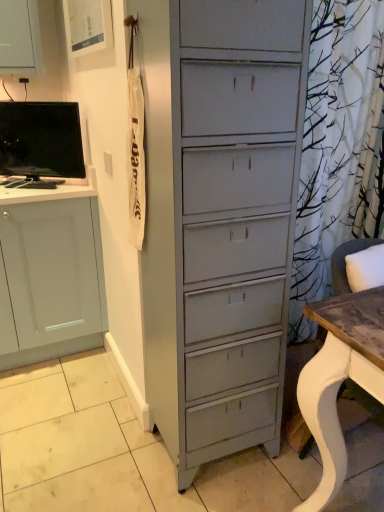
Question: Should I look upward or downward to see matte black monitor at left?

Choices:
 (A) up
 (B) down

Answer: (A)

Question: Considering the relative sizes of matte black monitor at left and white wood desk at right in the image provided, is matte black monitor at left smaller than white wood desk at right?

Choices:
 (A) yes
 (B) no

Answer: (A)

Question: From a real-world perspective, is matte black monitor at left on top of white wood desk at right?

Choices:
 (A) yes
 (B) no

Answer: (A)

Question: Would you consider matte black monitor at left to be distant from white wood desk at right?

Choices:
 (A) no
 (B) yes

Answer: (B)

Question: Is matte black monitor at left shorter than white wood desk at right?

Choices:
 (A) no
 (B) yes

Answer: (B)

Question: Considering the relative sizes of matte black monitor at left and white wood desk at right in the image provided, is matte black monitor at left wider than white wood desk at right?

Choices:
 (A) yes
 (B) no

Answer: (B)

Question: Does matte black monitor at left lie in front of white wood desk at right?

Choices:
 (A) yes
 (B) no

Answer: (B)

Question: Does white wood desk at right turn towards matte black monitor at left?

Choices:
 (A) no
 (B) yes

Answer: (A)

Question: Does white wood desk at right have a greater height compared to matte black monitor at left?

Choices:
 (A) no
 (B) yes

Answer: (B)

Question: Does white wood desk at right lie in front of matte black monitor at left?

Choices:
 (A) no
 (B) yes

Answer: (B)

Question: From the image's perspective, is white wood desk at right below matte black monitor at left?

Choices:
 (A) yes
 (B) no

Answer: (A)

Question: Is matte black monitor at left a part of white wood desk at right?

Choices:
 (A) yes
 (B) no

Answer: (B)

Question: Is white wood desk at right looking in the opposite direction of matte black monitor at left?

Choices:
 (A) no
 (B) yes

Answer: (A)

Question: Is matte black monitor at left taller or shorter than white wood desk at right?

Choices:
 (A) short
 (B) tall

Answer: (A)